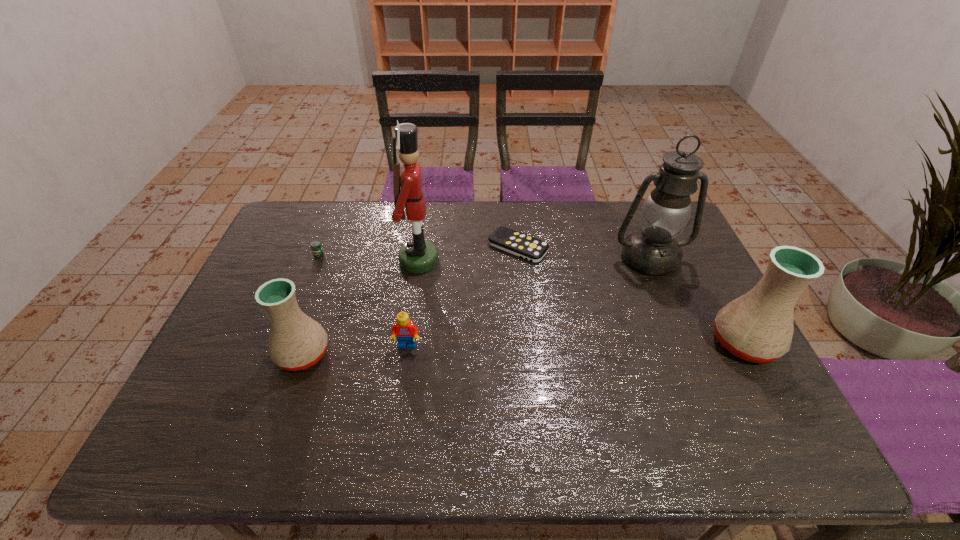
You are a GUI agent. You are given a task and a screenshot of the screen. Output one action in this format:
    pyautogui.click(x=<x>, y=<y>)
    Task: Click on the pottery that is positioned at the right edge
    This screenshot has width=960, height=540.
    Given the screenshot: What is the action you would take?
    pyautogui.click(x=758, y=327)

Find the location of a particular element. Image resolution: width=960 pixels, height=540 pixels. oil lamp situated at the right edge is located at coordinates (666, 212).

This screenshot has height=540, width=960. I want to click on object positioned at the far right corner, so click(666, 212).

In the image, there is a desktop. Identify the location of vacant space at the far edge. (557, 235).

What are the coordinates of `free spot at the near edge of the desktop` in the screenshot? It's located at (421, 383).

I want to click on free space at the left edge of the desktop, so click(228, 332).

The height and width of the screenshot is (540, 960). Identify the location of vacant space at the right edge of the desktop. (696, 305).

The width and height of the screenshot is (960, 540). I want to click on empty space that is in between the left pottery and the taller pottery, so click(x=523, y=348).

The width and height of the screenshot is (960, 540). What are the coordinates of `empty space between the shorter pottery and the third tallest object` in the screenshot? It's located at (523, 348).

The image size is (960, 540). I want to click on free spot between the sixth tallest object and the third shortest object, so click(363, 300).